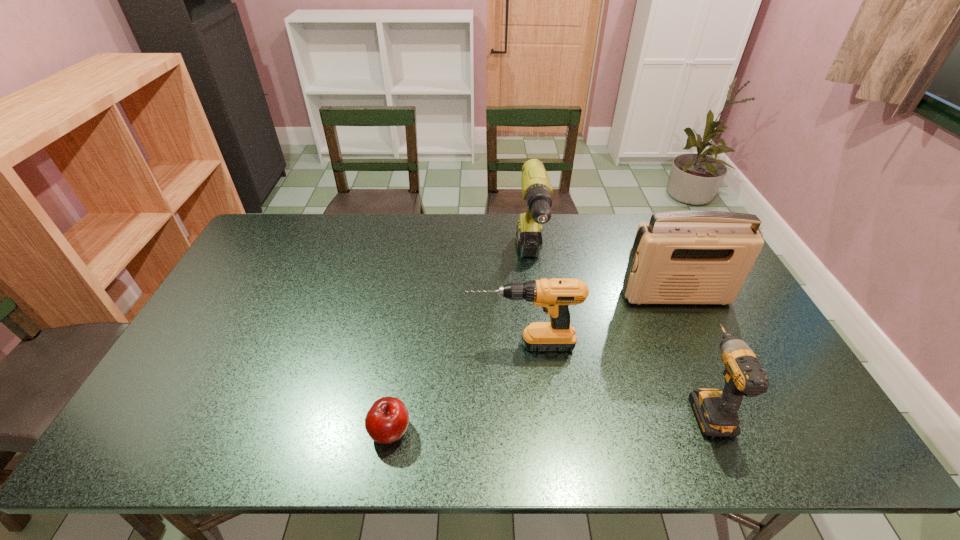
The width and height of the screenshot is (960, 540). I want to click on vacant space that is in between the third nearest object and the radio receiver, so click(x=599, y=320).

Identify the location of vacant area that lies between the farthest drill and the nearest drill. (619, 335).

Where is `free space between the radio receiver and the tallest drill`? The height and width of the screenshot is (540, 960). free space between the radio receiver and the tallest drill is located at coordinates (603, 279).

Locate an element on the screen. the closest object relative to the rightmost drill is located at coordinates (679, 257).

Where is `the closest object to the tallest drill`? This screenshot has width=960, height=540. the closest object to the tallest drill is located at coordinates (554, 295).

Identify the location of the third closest drill to the leftmost object. (716, 411).

Select which drill is the third closest to the shortest object. Please provide its 2D coordinates. Your answer should be formatted as a tuple, i.e. [(x, y)], where the tuple contains the x and y coordinates of a point satisfying the conditions above.

[(716, 411)]

This screenshot has height=540, width=960. I want to click on vacant region that satisfies the following two spatial constraints: 1. at the tip of the third nearest object; 2. on the front side of the apple, so click(x=530, y=431).

Locate an element on the screen. This screenshot has width=960, height=540. free location that satisfies the following two spatial constraints: 1. at the tip of the third nearest object; 2. with the drill bit of the nearest drill facing forward is located at coordinates (527, 406).

Identify the location of vacant space that satisfies the following two spatial constraints: 1. at the tip of the second nearest drill; 2. with the drill bit of the rightmost drill facing forward. Image resolution: width=960 pixels, height=540 pixels. (527, 406).